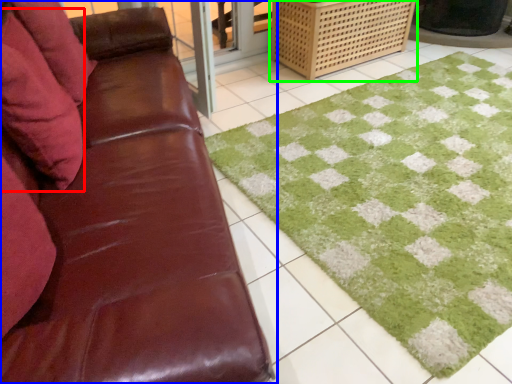
Question: Which object is the closest to the pillow (highlighted by a red box)? Choose among these: studio couch (highlighted by a blue box) or crate (highlighted by a green box).

Choices:
 (A) studio couch
 (B) crate

Answer: (A)